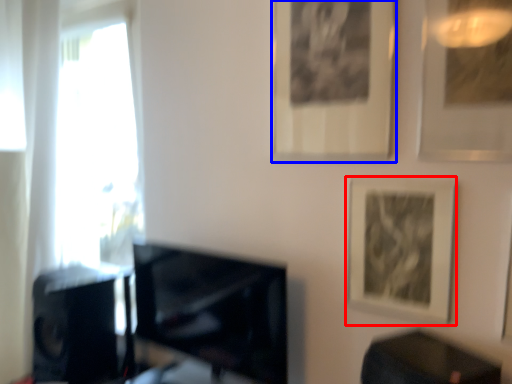
Question: Which object appears closest to the camera in this image, picture frame (highlighted by a red box) or picture frame (highlighted by a blue box)?

Choices:
 (A) picture frame
 (B) picture frame

Answer: (A)